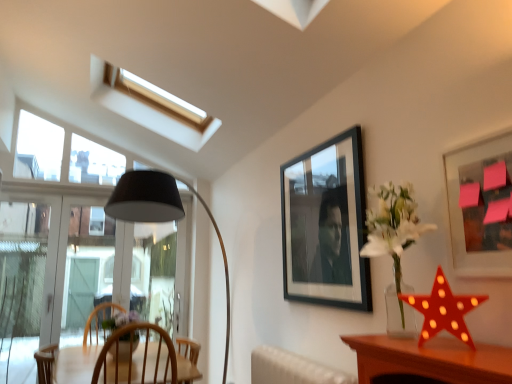
What are the coordinates of `blank space situated above transparent glass window at left (from a real-world perspective)` in the screenshot? It's located at (64, 190).